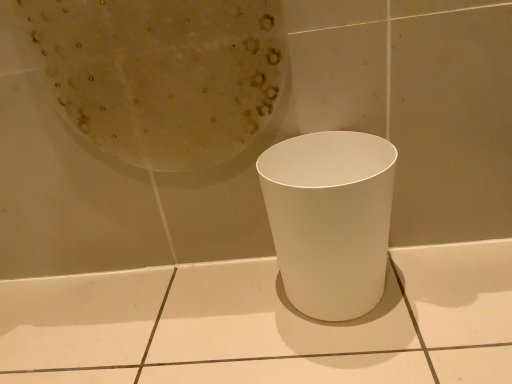
The width and height of the screenshot is (512, 384). What are the coordinates of `white matte waste container at center` in the screenshot? It's located at (330, 219).

The image size is (512, 384). What do you see at coordinates (330, 219) in the screenshot?
I see `white matte waste container at center` at bounding box center [330, 219].

Locate an element on the screen. white matte waste container at center is located at coordinates click(330, 219).